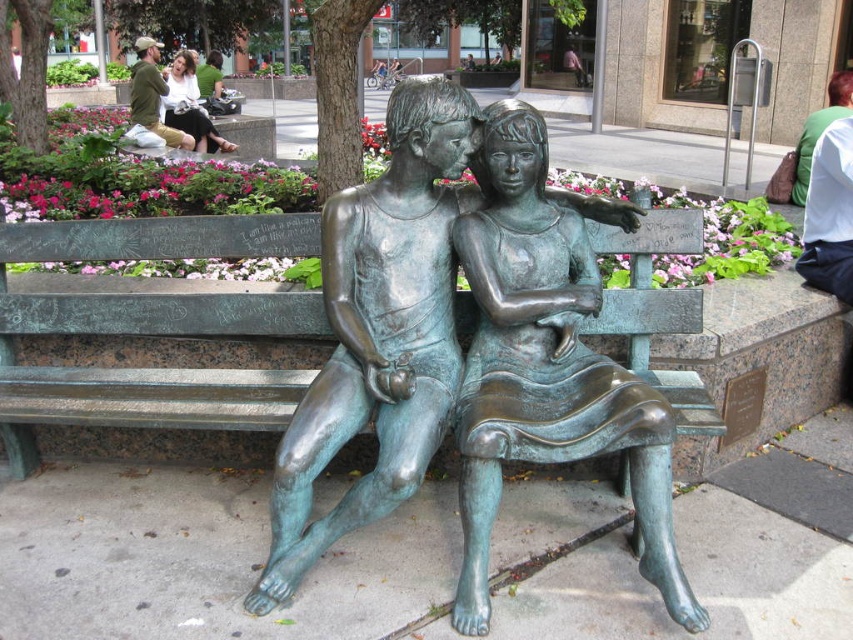
Question: Which object is closer to the camera taking this photo?

Choices:
 (A) green patina bench at center
 (B) bronze statue at center

Answer: (B)

Question: Does green patina bench at center appear under bronze statue at center?

Choices:
 (A) yes
 (B) no

Answer: (B)

Question: Observing the image, what is the correct spatial positioning of bronze statue at center in reference to matte green statue at upper left?

Choices:
 (A) left
 (B) right

Answer: (B)

Question: Which object appears farthest from the camera in this image?

Choices:
 (A) green patina bronze statue at center
 (B) green patina bench at center
 (C) matte green statue at upper left

Answer: (C)

Question: Can you confirm if green patina bench at center is positioned above bronze statue at center?

Choices:
 (A) no
 (B) yes

Answer: (B)

Question: Which is nearer to the matte green statue at upper left?

Choices:
 (A) green patina bench at center
 (B) bronze statue at center

Answer: (A)